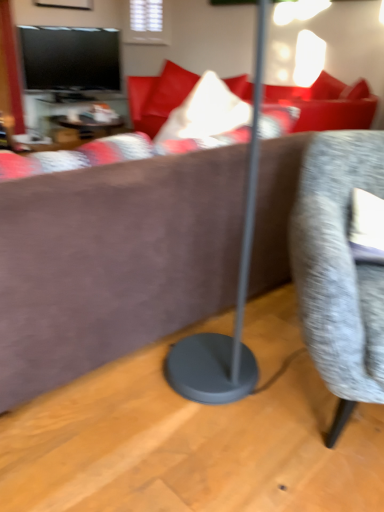
Measure the distance between textured gray chair at right and camera.

textured gray chair at right and camera are 96.67 centimeters apart.

Image resolution: width=384 pixels, height=512 pixels. I want to click on brown suede couch at center, so click(113, 262).

Is wooden table at center outside of brown suede couch at center?

Yes.

Looking at this image, does wooden table at center have a larger size compared to brown suede couch at center?

Incorrect, wooden table at center is not larger than brown suede couch at center.

Considering the points (45, 106) and (175, 160), which point is in front, point (45, 106) or point (175, 160)?

The point (175, 160) is closer to the camera.

Relative to wooden table at center, is brown suede couch at center in front or behind?

Clearly, brown suede couch at center is in front of wooden table at center.

In the scene shown: Is brown suede couch at center bigger or smaller than wooden table at center?

In the image, brown suede couch at center appears to be larger than wooden table at center.

Is point (145, 241) positioned in front of point (90, 105)?

Yes, point (145, 241) is in front of point (90, 105).

Is brown suede couch at center oriented towards wooden table at center?

No, brown suede couch at center is not aimed at wooden table at center.

From a real-world perspective, does brown suede couch at center sit lower than textured gray chair at right?

No.

Does brown suede couch at center turn towards textured gray chair at right?

No, brown suede couch at center does not turn towards textured gray chair at right.

Identify the location of chair beneath the brown suede couch at center (from a real-world perspective). (339, 269).

Measure the distance from brown suede couch at center to textured gray chair at right.

brown suede couch at center and textured gray chair at right are 20.49 inches apart.

From the image's perspective, relative to wooden table at center, is textured gray chair at right above or below?

textured gray chair at right is situated lower than wooden table at center in the image.

The height and width of the screenshot is (512, 384). I want to click on table beneath the textured gray chair at right (from a real-world perspective), so click(x=74, y=115).

Is textured gray chair at right facing away from wooden table at center?

No.

Considering the sizes of textured gray chair at right and wooden table at center in the image, is textured gray chair at right bigger or smaller than wooden table at center?

Clearly, textured gray chair at right is larger in size than wooden table at center.

From a real-world perspective, between textured gray chair at right and brown suede couch at center, who is vertically higher?

brown suede couch at center is physically above.

Looking at this image, does textured gray chair at right have a lesser width compared to brown suede couch at center?

No.

How far apart are textured gray chair at right and brown suede couch at center?

textured gray chair at right and brown suede couch at center are 20.49 inches apart from each other.

Is textured gray chair at right taller or shorter than brown suede couch at center?

Clearly, textured gray chair at right is shorter compared to brown suede couch at center.

Between point (69, 108) and point (375, 331), which one is positioned in front?

Positioned in front is point (375, 331).

Does wooden table at center have a lesser width compared to textured gray chair at right?

Yes.

Is wooden table at center at the right side of textured gray chair at right?

Incorrect, wooden table at center is not on the right side of textured gray chair at right.

Identify the location of studio couch on the right of wooden table at center. (113, 262).

This screenshot has width=384, height=512. In the image, there is a brown suede couch at center. In order to click on table above it (from the image's perspective) in this screenshot , I will do `click(74, 115)`.

In the scene shown: Looking at the image, which one is located closer to textured gray chair at right, wooden table at center or brown suede couch at center?

brown suede couch at center is positioned closer to the anchor textured gray chair at right.

Estimate the real-world distances between objects in this image. Which object is closer to wooden table at center, textured gray chair at right or brown suede couch at center?

brown suede couch at center lies closer to wooden table at center than the other object.

Looking at the image, which one is located closer to brown suede couch at center, textured gray chair at right or wooden table at center?

Among the two, textured gray chair at right is located nearer to brown suede couch at center.

When comparing their distances from brown suede couch at center, does wooden table at center or textured gray chair at right seem closer?

Among the two, textured gray chair at right is located nearer to brown suede couch at center.

Looking at the image, which one is located further to textured gray chair at right, brown suede couch at center or wooden table at center?

wooden table at center.

Estimate the real-world distances between objects in this image. Which object is further from wooden table at center, brown suede couch at center or textured gray chair at right?

Based on the image, textured gray chair at right appears to be further to wooden table at center.

The height and width of the screenshot is (512, 384). I want to click on studio couch between textured gray chair at right and wooden table at center from front to back, so click(113, 262).